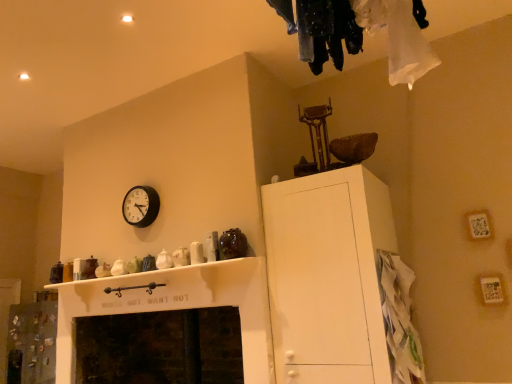
Question: Can we say dark stone fireplace at lower center lies outside white paper bag at lower right?

Choices:
 (A) yes
 (B) no

Answer: (A)

Question: Can you confirm if dark stone fireplace at lower center is taller than white paper bag at lower right?

Choices:
 (A) no
 (B) yes

Answer: (A)

Question: Does dark stone fireplace at lower center have a smaller size compared to white paper bag at lower right?

Choices:
 (A) yes
 (B) no

Answer: (B)

Question: From a real-world perspective, is dark stone fireplace at lower center physically below white paper bag at lower right?

Choices:
 (A) yes
 (B) no

Answer: (A)

Question: Can you confirm if dark stone fireplace at lower center is thinner than white paper bag at lower right?

Choices:
 (A) yes
 (B) no

Answer: (B)

Question: From the image's perspective, is white paper bag at lower right located above or below white matte cabinet at upper right?

Choices:
 (A) below
 (B) above

Answer: (A)

Question: Is white paper bag at lower right to the left or to the right of white matte cabinet at upper right in the image?

Choices:
 (A) left
 (B) right

Answer: (B)

Question: Looking at the image, does white paper bag at lower right seem bigger or smaller compared to white matte cabinet at upper right?

Choices:
 (A) big
 (B) small

Answer: (B)

Question: From a real-world perspective, is white paper bag at lower right physically located above or below white matte cabinet at upper right?

Choices:
 (A) below
 (B) above

Answer: (A)

Question: Does point (355, 352) appear closer or farther from the camera than point (410, 283)?

Choices:
 (A) farther
 (B) closer

Answer: (B)

Question: Looking at their shapes, would you say white matte cabinet at upper right is wider or thinner than white paper bag at lower right?

Choices:
 (A) thin
 (B) wide

Answer: (B)

Question: Based on their sizes in the image, would you say white matte cabinet at upper right is bigger or smaller than white paper bag at lower right?

Choices:
 (A) big
 (B) small

Answer: (A)

Question: Is white matte cabinet at upper right situated inside white paper bag at lower right or outside?

Choices:
 (A) inside
 (B) outside

Answer: (B)

Question: From a real-world perspective, is dark stone fireplace at lower center physically located above or below white paper bag at lower right?

Choices:
 (A) below
 (B) above

Answer: (A)

Question: From the image's perspective, relative to white paper bag at lower right, is dark stone fireplace at lower center above or below?

Choices:
 (A) above
 (B) below

Answer: (B)